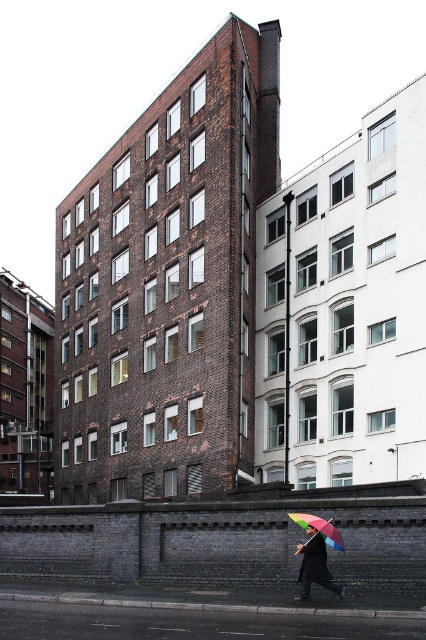
Question: Which point is farther from the camera taking this photo?

Choices:
 (A) (313, 529)
 (B) (302, 580)

Answer: (B)

Question: Can you confirm if rainbow umbrella at lower center is bigger than rainbow fabric umbrella at lower right?

Choices:
 (A) no
 (B) yes

Answer: (B)

Question: Which object is closer to the camera taking this photo?

Choices:
 (A) rainbow fabric umbrella at lower right
 (B) rainbow umbrella at lower center

Answer: (A)

Question: Is rainbow umbrella at lower center wider than rainbow fabric umbrella at lower right?

Choices:
 (A) yes
 (B) no

Answer: (B)

Question: Can you confirm if rainbow umbrella at lower center is wider than rainbow fabric umbrella at lower right?

Choices:
 (A) yes
 (B) no

Answer: (B)